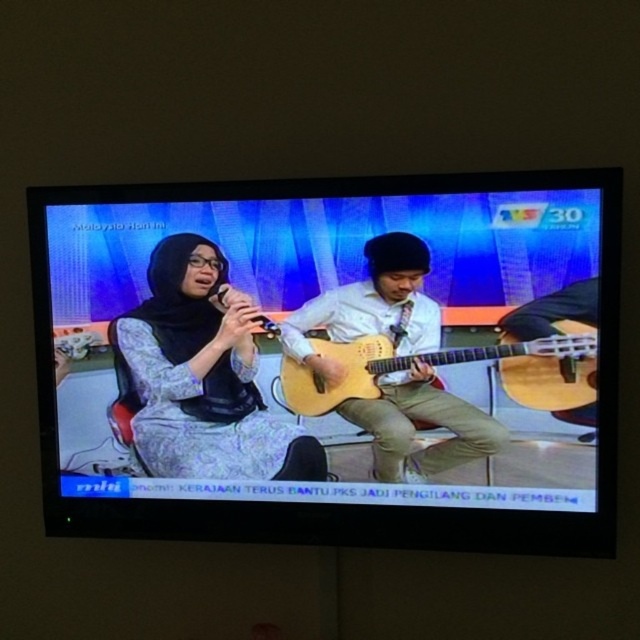
Does patterned fabric hijab at center appear on the right side of matte light brown guitar at center?

In fact, patterned fabric hijab at center is to the left of matte light brown guitar at center.

Find the location of a particular element. This screenshot has width=640, height=640. patterned fabric hijab at center is located at coordinates (200, 376).

Locate an element on the screen. patterned fabric hijab at center is located at coordinates (200, 376).

How far apart are matte wood guitar at center and matte light brown guitar at center?

The distance of matte wood guitar at center from matte light brown guitar at center is 4.63 inches.

Does matte wood guitar at center have a lesser height compared to matte light brown guitar at center?

No, matte wood guitar at center is not shorter than matte light brown guitar at center.

Is point (145, 428) positioned behind point (444, 401)?

Yes.

Identify the location of matte wood guitar at center. (324, 356).

Who is more distant from viewer, (x=256, y=420) or (x=580, y=394)?

Positioned behind is point (x=256, y=420).

Which is above, patterned fabric hijab at center or light wood acoustic guitar at center?

patterned fabric hijab at center is above.

Who is more forward, [140,394] or [476,353]?

Positioned in front is point [476,353].

Where is `patterned fabric hijab at center`? The image size is (640, 640). patterned fabric hijab at center is located at coordinates (200, 376).